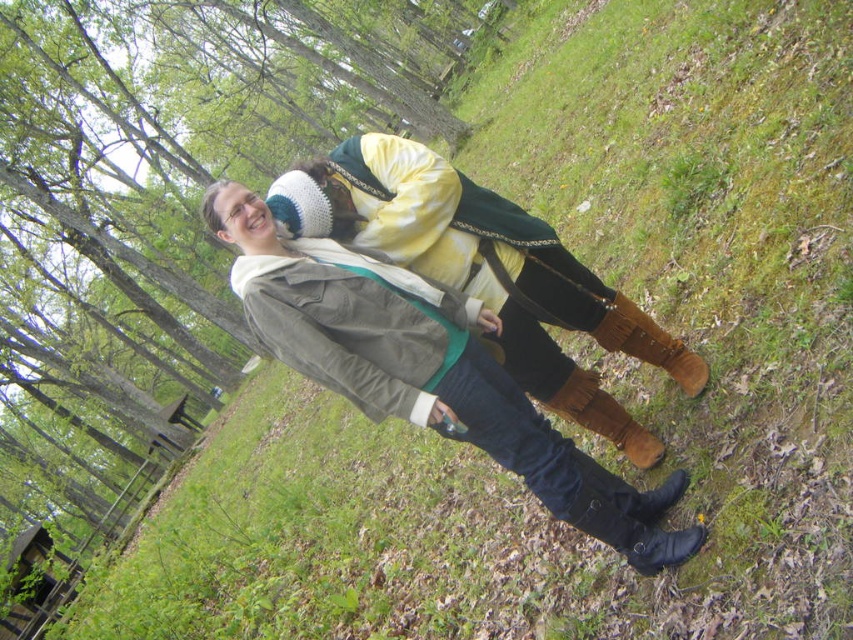
You are standing in the park and see the matte brown boots at center. Can you determine their exact location based on the coordinates provided?

The matte brown boots at center are located at point (427, 372).